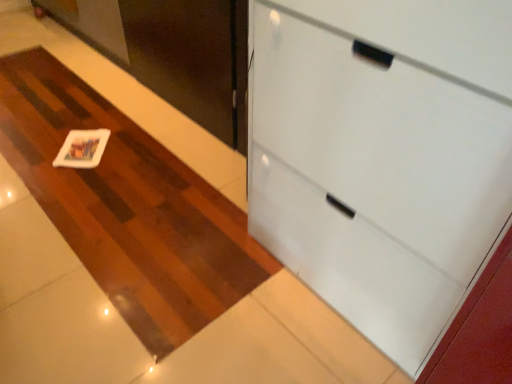
Question: Can you confirm if white glossy cabinet at upper right is taller than white matte coaster at center?

Choices:
 (A) no
 (B) yes

Answer: (B)

Question: Considering the relative sizes of white glossy cabinet at upper right and white matte coaster at center in the image provided, is white glossy cabinet at upper right smaller than white matte coaster at center?

Choices:
 (A) no
 (B) yes

Answer: (A)

Question: Does white glossy cabinet at upper right lie in front of white matte coaster at center?

Choices:
 (A) no
 (B) yes

Answer: (B)

Question: From the image's perspective, would you say white glossy cabinet at upper right is shown under white matte coaster at center?

Choices:
 (A) yes
 (B) no

Answer: (A)

Question: Does white glossy cabinet at upper right have a larger size compared to white matte coaster at center?

Choices:
 (A) yes
 (B) no

Answer: (A)

Question: Is white glossy cabinet at upper right oriented away from white matte coaster at center?

Choices:
 (A) no
 (B) yes

Answer: (A)

Question: From a real-world perspective, is white matte coaster at center located beneath matte black door at upper left?

Choices:
 (A) yes
 (B) no

Answer: (A)

Question: Is white matte coaster at center far away from matte black door at upper left?

Choices:
 (A) no
 (B) yes

Answer: (A)

Question: Can you confirm if white matte coaster at center is taller than matte black door at upper left?

Choices:
 (A) no
 (B) yes

Answer: (A)

Question: Is white matte coaster at center facing towards matte black door at upper left?

Choices:
 (A) yes
 (B) no

Answer: (B)

Question: Is matte black door at upper left a part of white matte coaster at center?

Choices:
 (A) no
 (B) yes

Answer: (A)

Question: Is white matte coaster at center not inside matte black door at upper left?

Choices:
 (A) no
 (B) yes

Answer: (B)

Question: From the image's perspective, is matte black door at upper left located above white matte card at center?

Choices:
 (A) no
 (B) yes

Answer: (B)